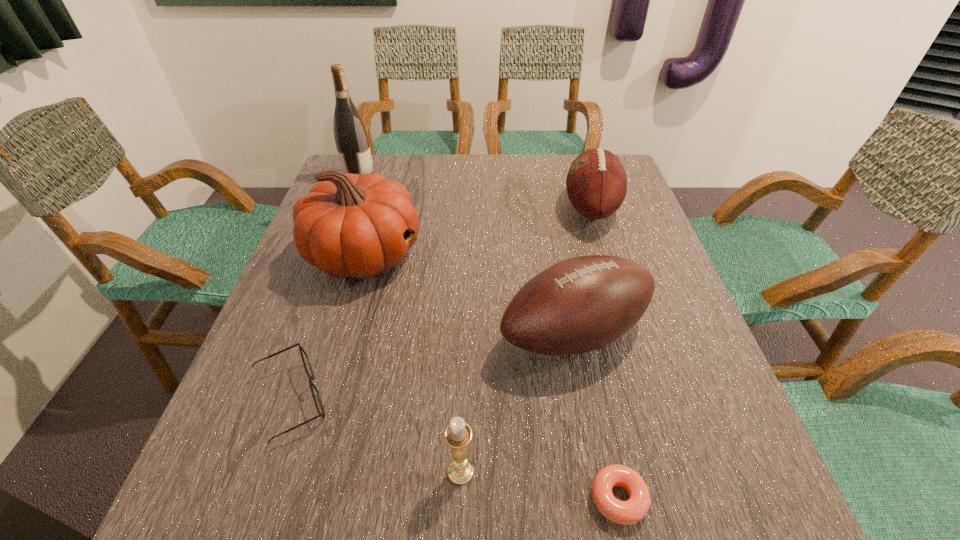
At what (x,y) coordinates should I click in order to perform the action: click on spectacles positioned at the left edge. Please return your answer as a coordinate pair (x, y). Looking at the image, I should click on (316, 396).

Where is `object located at the far left corner`? The image size is (960, 540). object located at the far left corner is located at coordinates (351, 138).

Find the location of a particular element. This screenshot has width=960, height=540. object present at the far right corner is located at coordinates coord(596,183).

The height and width of the screenshot is (540, 960). In the image, there is a desktop. In order to click on vacant space at the far edge in this screenshot , I will do `click(462, 184)`.

In the image, there is a desktop. Identify the location of vacant space at the near edge. (520, 491).

At what (x,y) coordinates should I click in order to perform the action: click on blank area at the left edge. Please return your answer as a coordinate pair (x, y). The height and width of the screenshot is (540, 960). Looking at the image, I should click on (341, 303).

This screenshot has height=540, width=960. What are the coordinates of `vacant space at the right edge of the desktop` in the screenshot? It's located at (x=646, y=263).

This screenshot has width=960, height=540. I want to click on free space at the far left corner, so click(378, 165).

Where is `vacant area that lies between the spectacles and the farther football (American)`? The image size is (960, 540). vacant area that lies between the spectacles and the farther football (American) is located at coordinates (441, 304).

The height and width of the screenshot is (540, 960). I want to click on vacant space in between the farther football (American) and the tallest object, so click(475, 192).